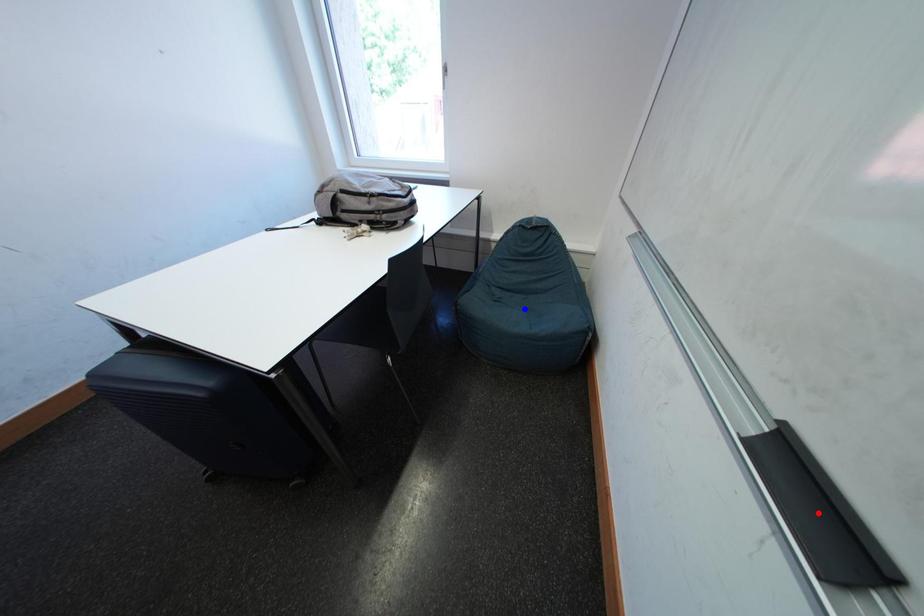
Question: In the image, two points are highlighted. Which point is nearer to the camera? Reply with the corresponding letter.

Choices:
 (A) blue point
 (B) red point

Answer: (B)